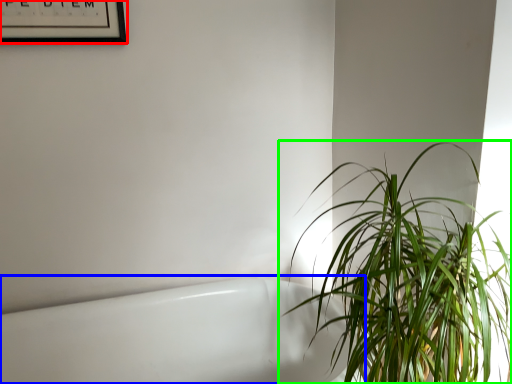
Question: Estimate the real-world distances between objects in this image. Which object is closer to picture frame (highlighted by a red box), bath (highlighted by a blue box) or houseplant (highlighted by a green box)?

Choices:
 (A) bath
 (B) houseplant

Answer: (A)